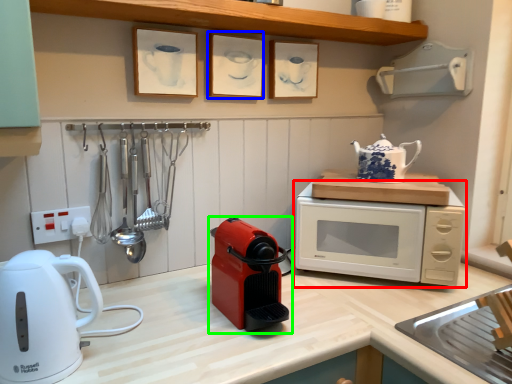
Question: Estimate the real-world distances between objects in this image. Which object is closer to microwave oven (highlighted by a red box), picture frame (highlighted by a blue box) or home appliance (highlighted by a green box)?

Choices:
 (A) picture frame
 (B) home appliance

Answer: (B)